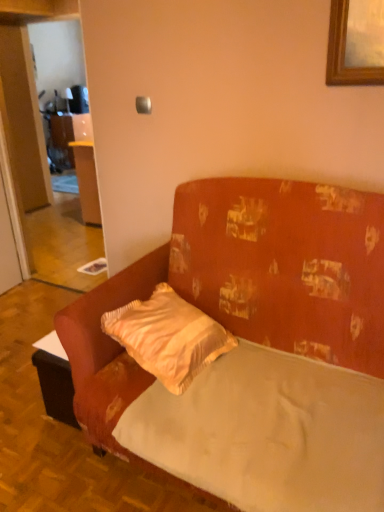
Question: Does point (205, 347) appear closer or farther from the camera than point (91, 391)?

Choices:
 (A) farther
 (B) closer

Answer: (A)

Question: Considering the positions of satin yellow pillow at center and velvet orange couch at center in the image, is satin yellow pillow at center taller or shorter than velvet orange couch at center?

Choices:
 (A) short
 (B) tall

Answer: (A)

Question: Which object is the farthest from the smooth white mattress at center?

Choices:
 (A) velvet orange couch at center
 (B) satin yellow pillow at center

Answer: (B)

Question: Estimate the real-world distances between objects in this image. Which object is farther from the velvet orange couch at center?

Choices:
 (A) smooth white mattress at center
 (B) satin yellow pillow at center

Answer: (B)